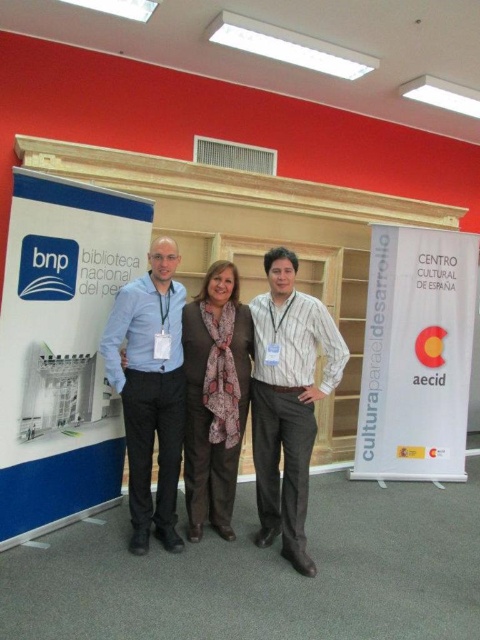
You are standing in the room where the three people are. You see a point at coordinates [417,355]. What object is this point located on?

The point at coordinates [417,355] is located on the white paper at center.

You are at a conference and want to know which of the two people in the center has a shorter height. The two people are wearing a striped cotton shirt at center and a matte blue shirt at center. According to the image, which one is shorter?

The striped cotton shirt at center is not as tall as matte blue shirt at center, so the person wearing the striped cotton shirt at center is shorter.